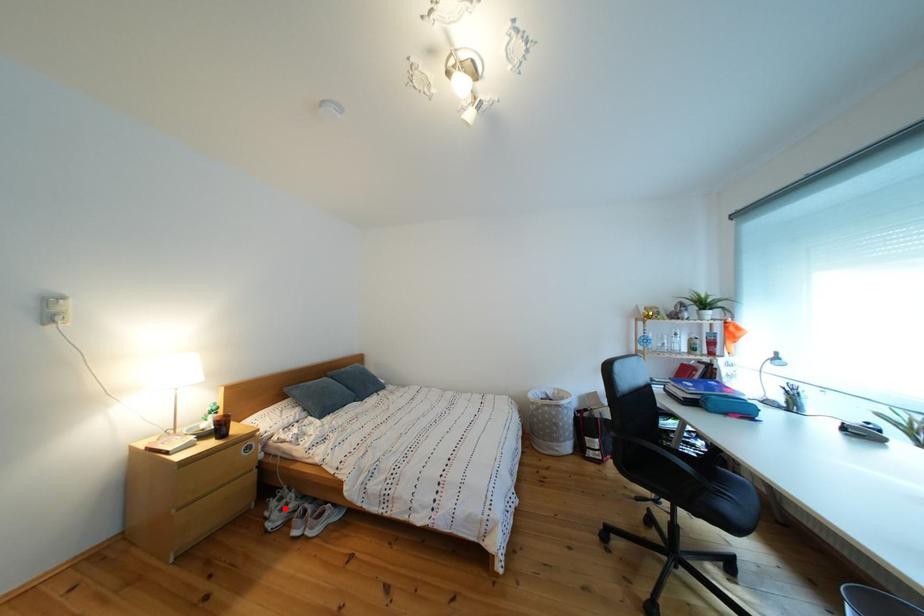
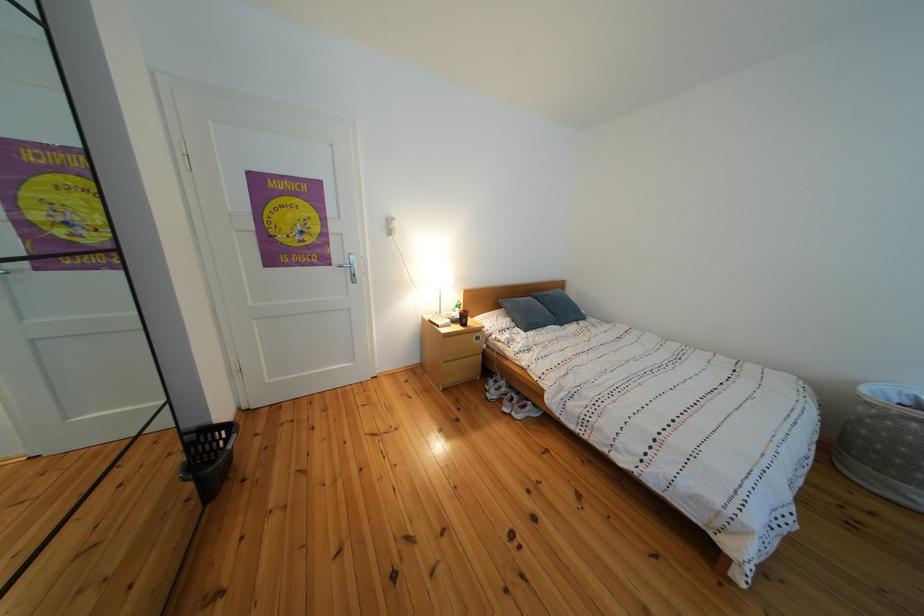
In the second image, find the point that corresponds to the highlighted location in the first image.

(503, 387)